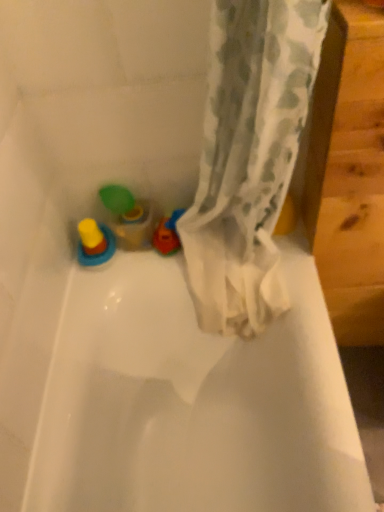
Question: Is yellow rubber ring at lower left, which is the 1th toy in left-to-right order, wider or thinner than translucent plastic cup at left, which appears as the second toy when viewed from the left?

Choices:
 (A) thin
 (B) wide

Answer: (B)

Question: In the image, is yellow rubber ring at lower left, which appears as the 2th toy when viewed from the right, positioned in front of or behind translucent plastic cup at left, which appears as the second toy when viewed from the left?

Choices:
 (A) front
 (B) behind

Answer: (A)

Question: From a real-world perspective, is yellow rubber ring at lower left, which appears as the 2th toy when viewed from the right, physically located above or below translucent plastic cup at left, which appears as the second toy when viewed from the left?

Choices:
 (A) above
 (B) below

Answer: (A)

Question: Does point (134, 248) appear closer or farther from the camera than point (89, 218)?

Choices:
 (A) farther
 (B) closer

Answer: (B)

Question: Is translucent plastic cup at left, which appears as the second toy when viewed from the left, in front of or behind yellow rubber ring at lower left, which appears as the 2th toy when viewed from the right, in the image?

Choices:
 (A) front
 (B) behind

Answer: (B)

Question: Considering the positions of translucent plastic cup at left, which is counted as the first toy, starting from the right, and yellow rubber ring at lower left, which is the 1th toy in left-to-right order, in the image, is translucent plastic cup at left, which is counted as the first toy, starting from the right, wider or thinner than yellow rubber ring at lower left, which is the 1th toy in left-to-right order,?

Choices:
 (A) wide
 (B) thin

Answer: (B)

Question: From a real-world perspective, is translucent plastic cup at left, which is counted as the first toy, starting from the right, above or below yellow rubber ring at lower left, which appears as the 2th toy when viewed from the right?

Choices:
 (A) above
 (B) below

Answer: (B)